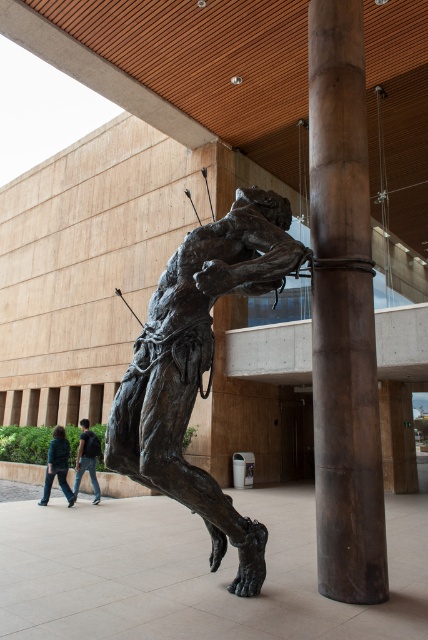
You are a delivery person who needs to place a small box on either the smooth brown wood at center or the jeans at lower left. Which surface would you choose to ensure the box stays stable?

The smooth brown wood at center is taller than the jeans at lower left, so placing the box on the smooth brown wood at center would provide a more stable and elevated surface.

You are standing at the camera position and want to place a 2.5 meter long banner between yourself and the smooth brown wood at center. Will the banner fit without overlapping the wood?

The distance between you and the smooth brown wood at center is 3.65 meters, and the banner is 2.5 meters long. Since 2.5 meters is less than 3.65 meters, the banner will fit without overlapping the wood.

You are an artist planning to place a new sculpture between the smooth brown wood at center and the green denim jacket at lower left. Which object should you position closer to the front to ensure visibility of both?

The smooth brown wood at center is taller than the green denim jacket at lower left, so to ensure visibility of both, position the taller smooth brown wood at center closer to the back and the shorter green denim jacket at lower left closer to the front.